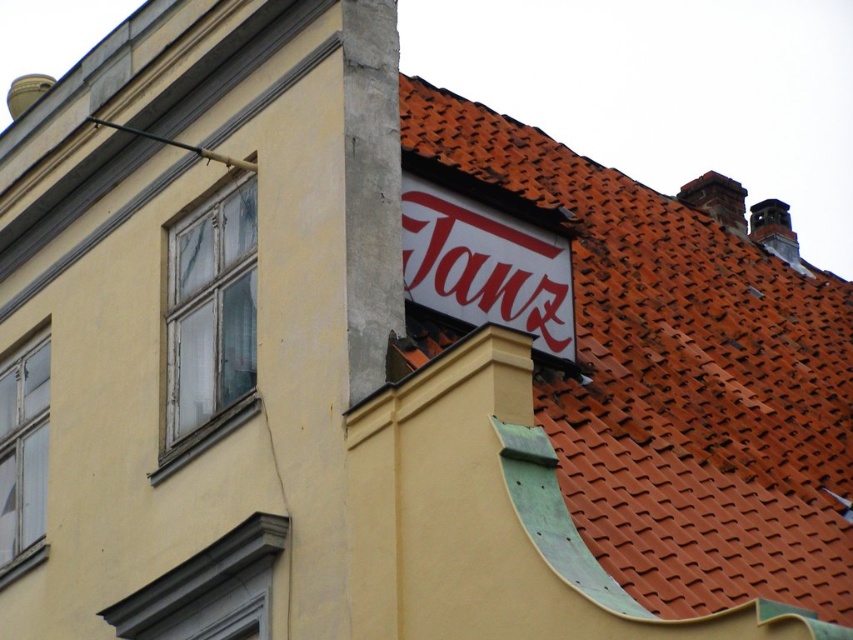
Question: Which of the following is the farthest from the observer?

Choices:
 (A) red clay tiles at upper right
 (B) clear glass window at lower left
 (C) white wooden window at upper left
 (D) smooth gray window frame at lower left

Answer: (B)

Question: Is red clay tiles at upper right above smooth gray window frame at lower left?

Choices:
 (A) no
 (B) yes

Answer: (B)

Question: Does white wooden window at upper left lie in front of clear glass window at lower left?

Choices:
 (A) no
 (B) yes

Answer: (B)

Question: Estimate the real-world distances between objects in this image. Which object is closer to the white matte sign at upper center?

Choices:
 (A) red clay tiles at upper right
 (B) white wooden window at upper left
 (C) clear glass window at lower left

Answer: (B)

Question: Which object is positioned closest to the red clay tiles at upper right?

Choices:
 (A) white matte sign at upper center
 (B) smooth gray window frame at lower left
 (C) white wooden window at upper left
 (D) clear glass window at lower left

Answer: (B)

Question: From the image, what is the correct spatial relationship of red clay tiles at upper right in relation to white wooden window at upper left?

Choices:
 (A) right
 (B) left

Answer: (A)